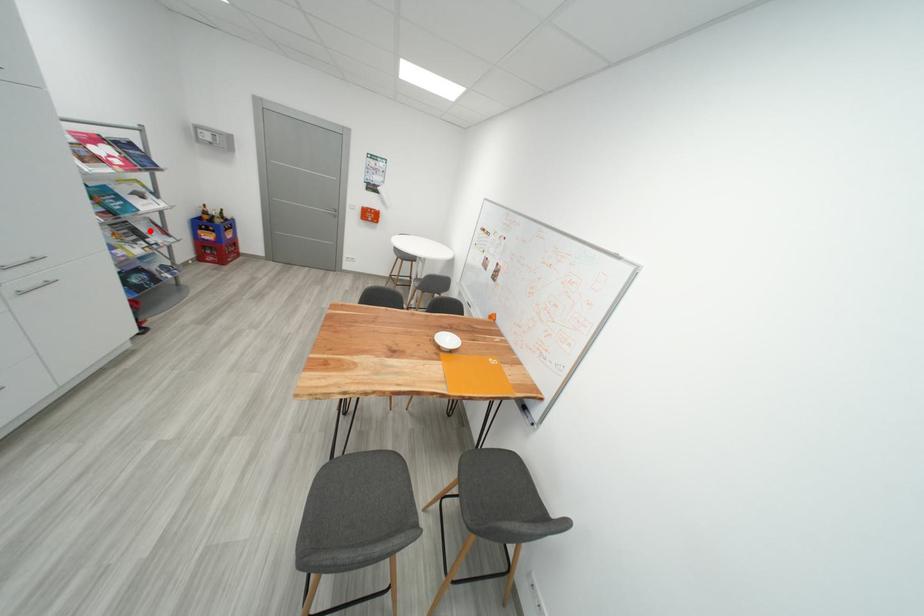
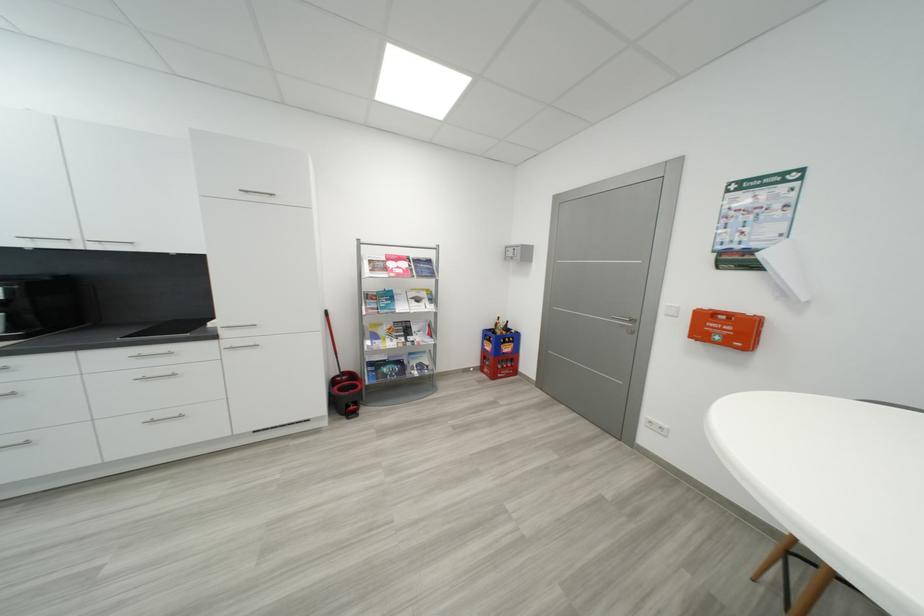
In the second image, find the point that corresponds to the highlighted location in the first image.

(421, 330)